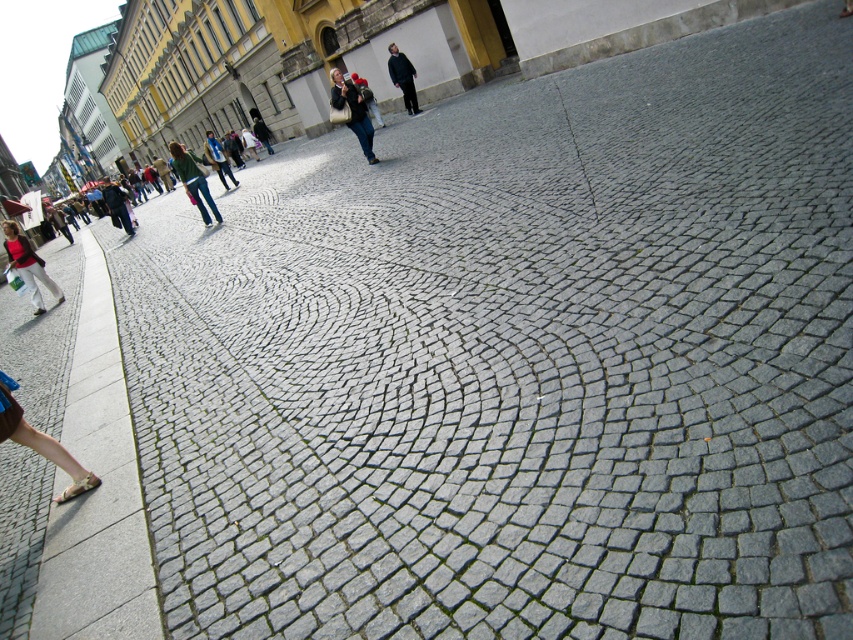
Question: Which point appears closest to the camera in this image?

Choices:
 (A) click(35, 268)
 (B) click(78, 493)
 (C) click(213, 209)

Answer: (B)

Question: Estimate the real-world distances between objects in this image. Which object is closer to the dark gray fabric jacket at center?

Choices:
 (A) matte black jacket at center
 (B) light brown leather sandal at lower left

Answer: (A)

Question: Is matte black jacket at center to the right of green fabric jacket at center from the viewer's perspective?

Choices:
 (A) no
 (B) yes

Answer: (B)

Question: From the image, what is the correct spatial relationship of matte black jacket at center in relation to light brown leather sandal at lower left?

Choices:
 (A) above
 (B) below

Answer: (A)

Question: Is green fabric jacket at center wider than light brown leather sandal at lower left?

Choices:
 (A) yes
 (B) no

Answer: (A)

Question: Among these objects, which one is nearest to the camera?

Choices:
 (A) light brown leather sandal at lower left
 (B) matte black jacket at center

Answer: (A)